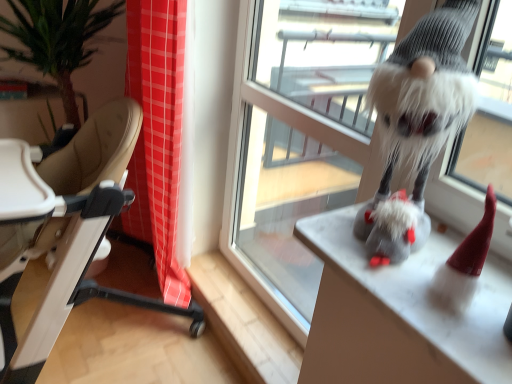
At what (x,y) coordinates should I click in order to perform the action: click on blank area to the left of transparent glass window at center. Please return your answer as a coordinate pair (x, y). Looking at the image, I should click on (227, 289).